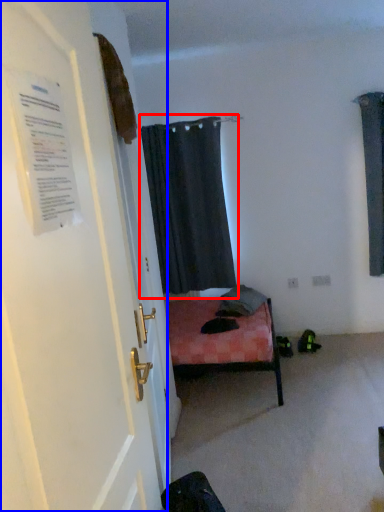
Question: Which object appears farthest to the camera in this image, curtain (highlighted by a red box) or door (highlighted by a blue box)?

Choices:
 (A) curtain
 (B) door

Answer: (A)